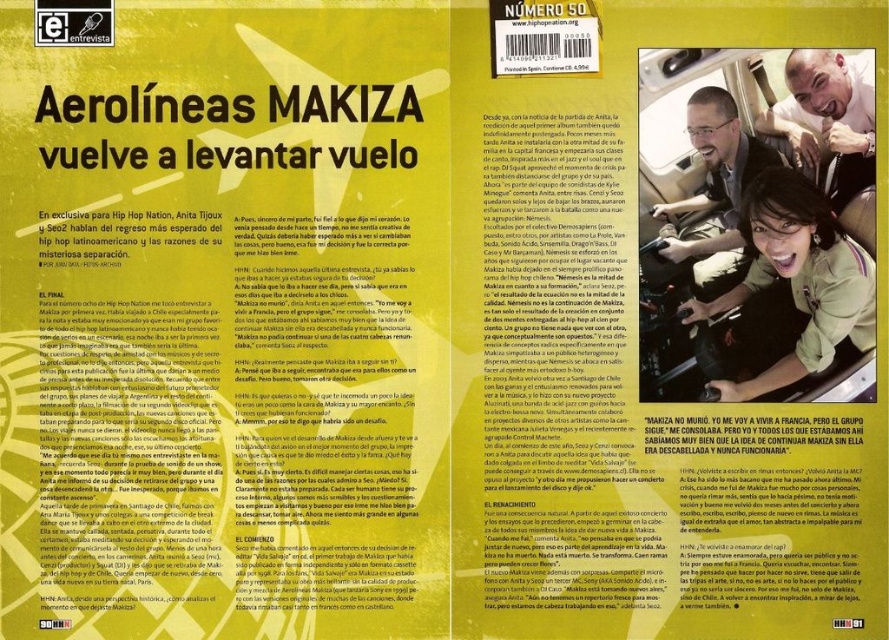
You are a graphic designer reviewing the magazine layout. You notice the matte black hair at upper right and the matte black man at upper right. Which object is located lower on the left page?

The matte black hair at upper right is positioned under the matte black man at upper right, so it is lower on the left page.